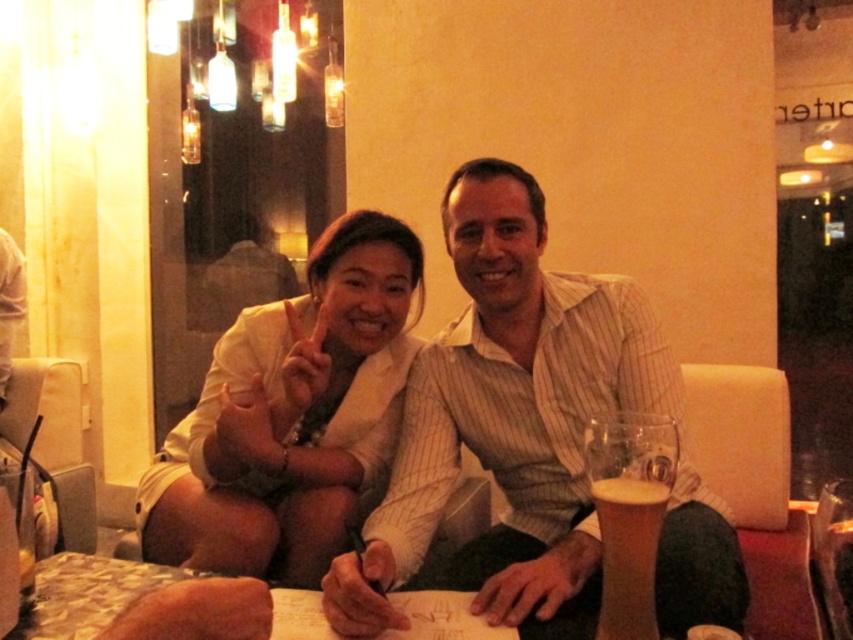
You are a photographer standing in front of the scene. You want to take a closeup shot of the white textured blouse at center. Considering your current position, is the distance sufficient for a clear, detailed closeup without needing to move closer?

The distance between the white textured blouse at center and the viewer is 1.24 meters. This distance is sufficient for a clear, detailed closeup shot without needing to move closer, as most cameras can focus effectively at this range.

You are a photographer at a cafe and want to capture a shot of both the white textured blouse at center and the foamy glass beer at lower right. Since the beer is partially blocking the blouse, can you adjust your position to ensure both are fully visible in the photo?

The foamy glass beer at lower right is behind the white textured blouse at center, so moving your camera position slightly forward or to the side should allow both objects to be fully visible without obstruction.